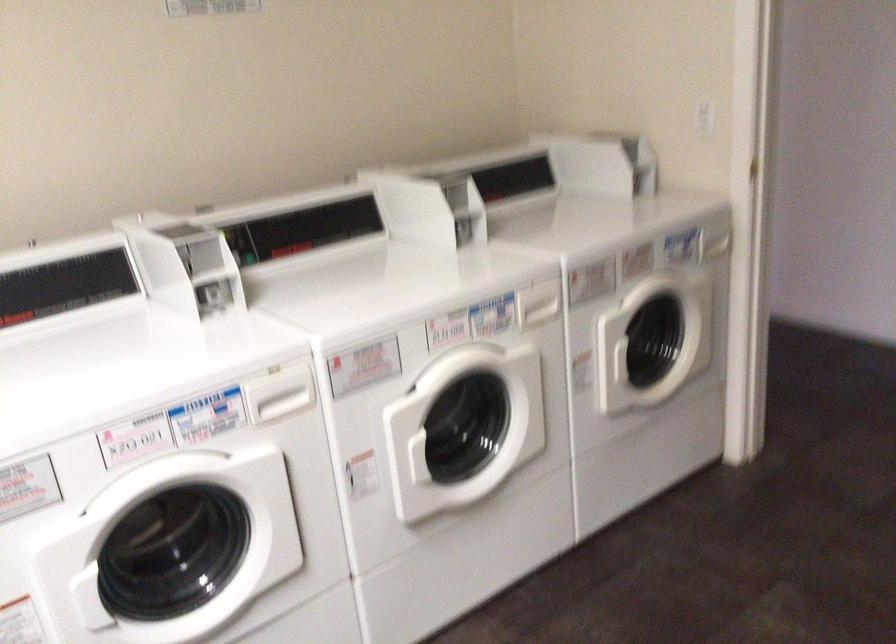
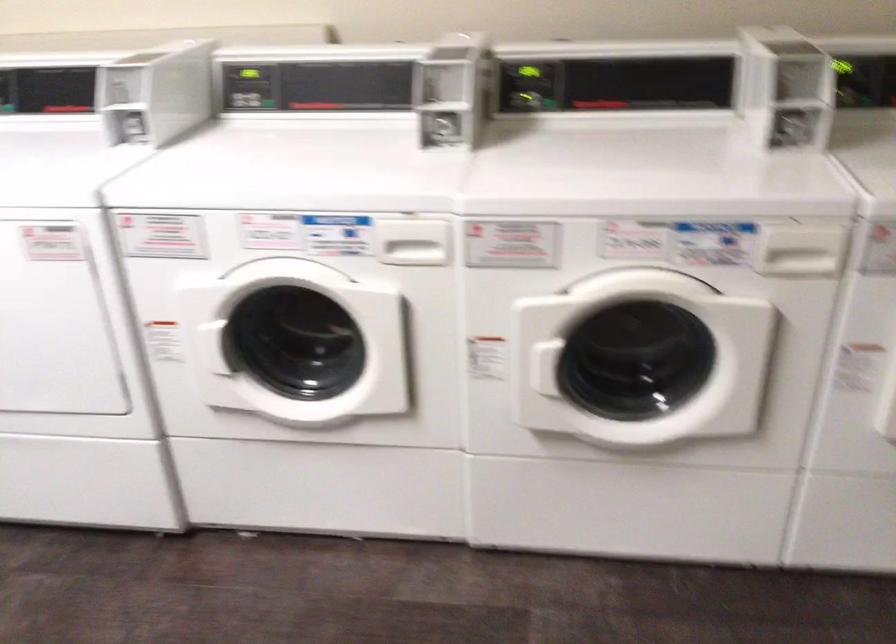
The point at (538,301) is marked in the first image. Where is the corresponding point in the second image?

(800, 251)